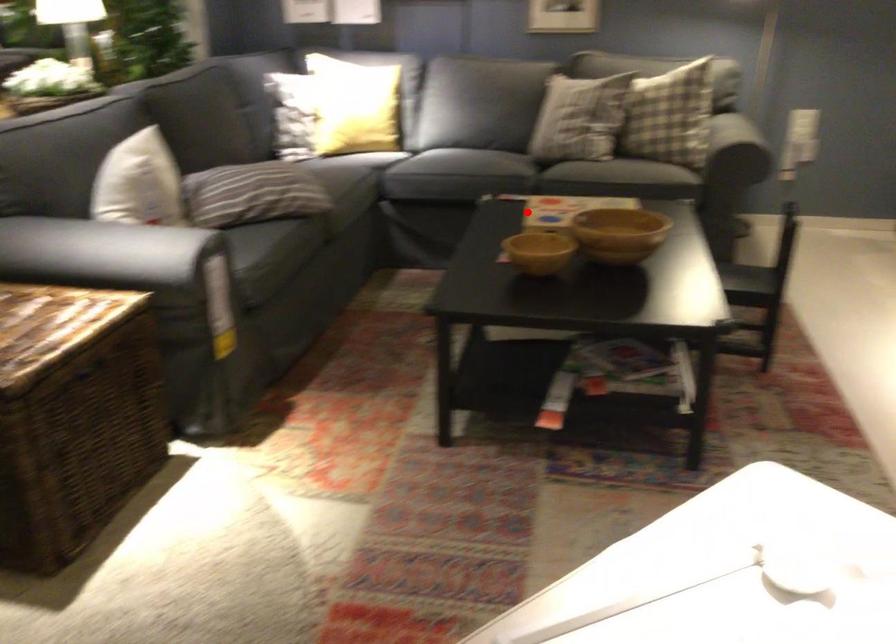
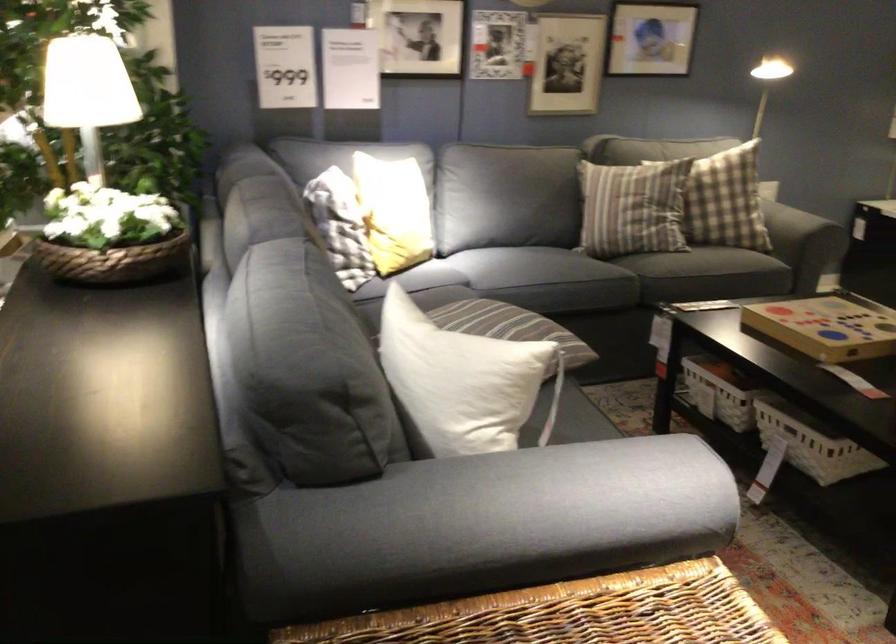
Find the pixel in the second image that matches the highlighted location in the first image.

(828, 326)